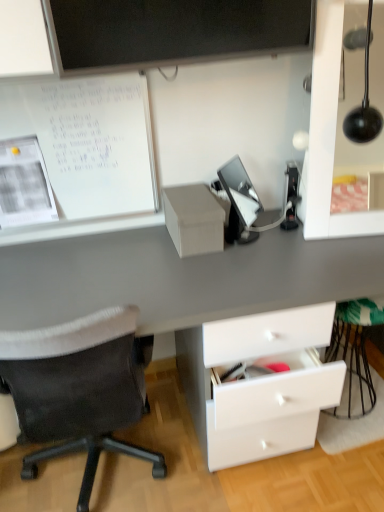
Find the location of a particular element. The height and width of the screenshot is (512, 384). vacant position to the left of matte cardboard box at center is located at coordinates (140, 246).